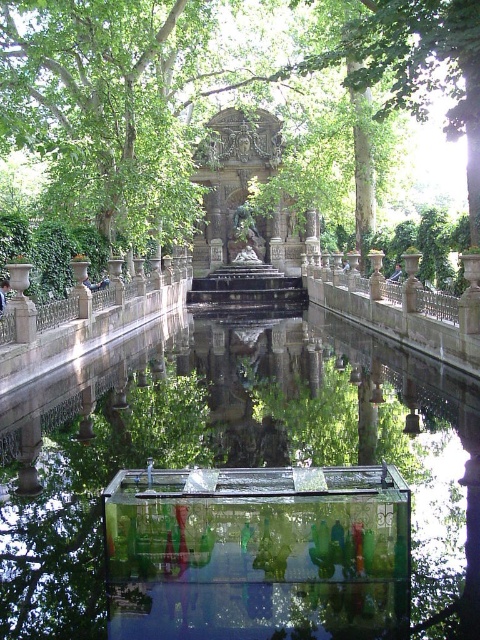
Does transparent glass water at center have a greater height compared to green leafy tree at center?

No, transparent glass water at center is not taller than green leafy tree at center.

The image size is (480, 640). What are the coordinates of `transparent glass water at center` in the screenshot? It's located at (241, 506).

Is point (403, 444) farther from camera compared to point (387, 172)?

No, (403, 444) is closer to viewer.

I want to click on transparent glass water at center, so click(241, 506).